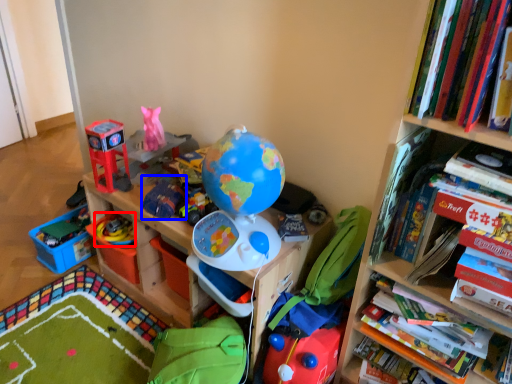
Question: Which object appears farthest to the camera in this image, toy (highlighted by a red box) or toy (highlighted by a blue box)?

Choices:
 (A) toy
 (B) toy

Answer: (A)